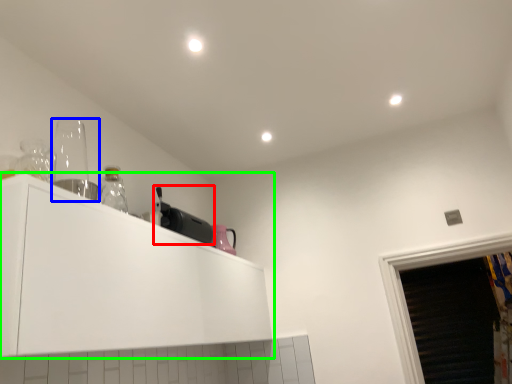
Question: Considering the real-world distances, which object is closest to appliance (highlighted by a red box)? appliance (highlighted by a blue box) or cabinetry (highlighted by a green box).

Choices:
 (A) appliance
 (B) cabinetry

Answer: (B)